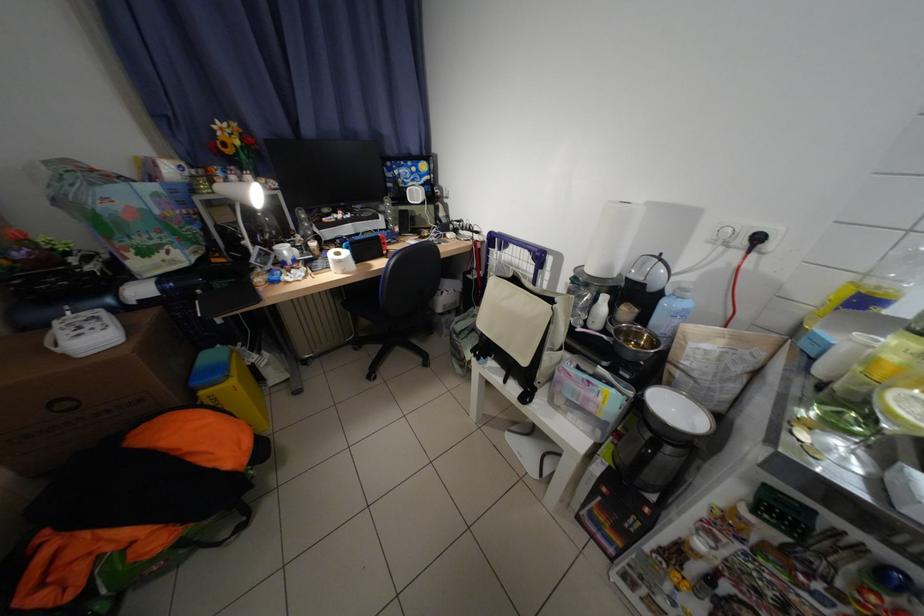
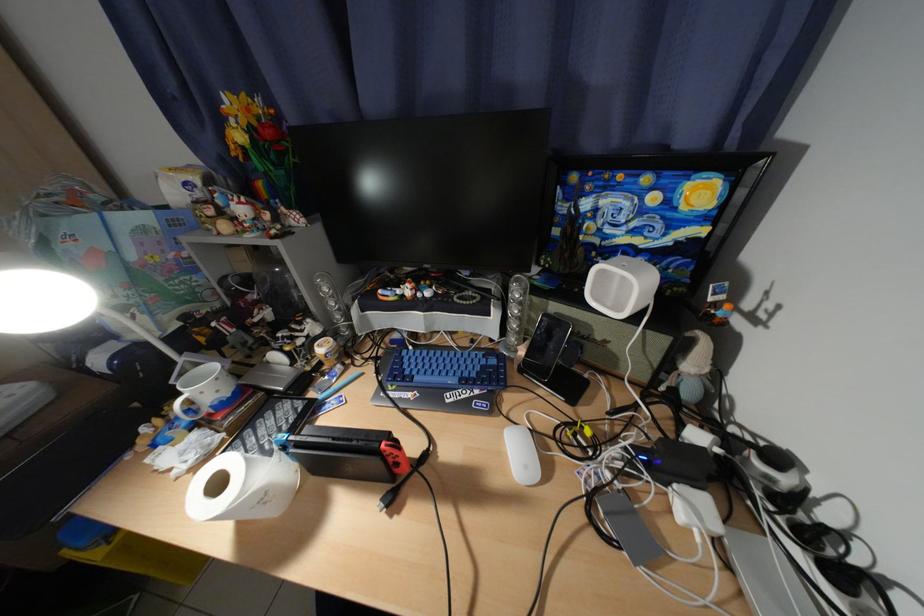
Find the pixel in the second image that matches pixel 408 230 in the first image.

(533, 354)